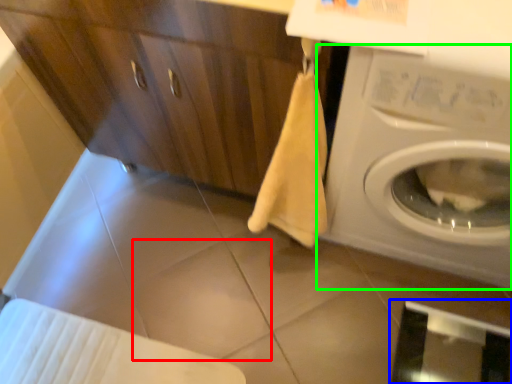
Question: Considering the real-world distances, which object is closest to tile (highlighted by a red box)? screen door (highlighted by a blue box) or washing machine (highlighted by a green box).

Choices:
 (A) screen door
 (B) washing machine

Answer: (B)